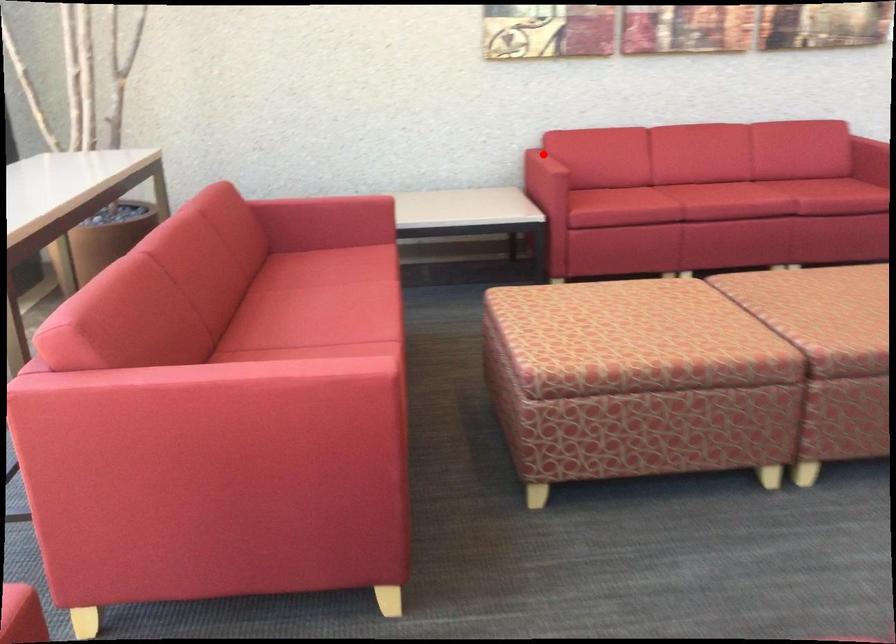
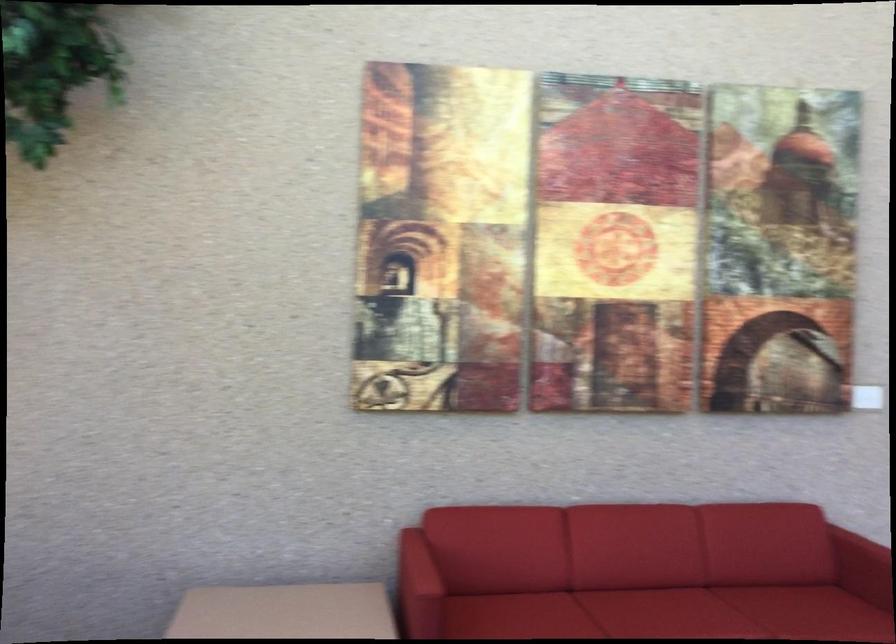
In the second image, find the point that corresponds to the highlighted location in the first image.

(418, 564)